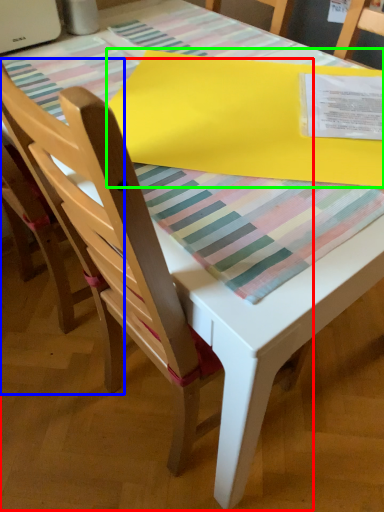
Question: Which object is positioned closest to chair (highlighted by a red box)? Select from chair (highlighted by a blue box) and blanket (highlighted by a green box).

Choices:
 (A) chair
 (B) blanket

Answer: (A)